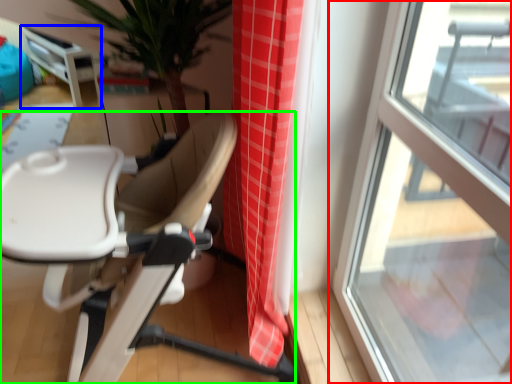
Question: Which object is positioned closest to window (highlighted by a red box)? Select from table (highlighted by a blue box) and chair (highlighted by a green box).

Choices:
 (A) table
 (B) chair

Answer: (B)